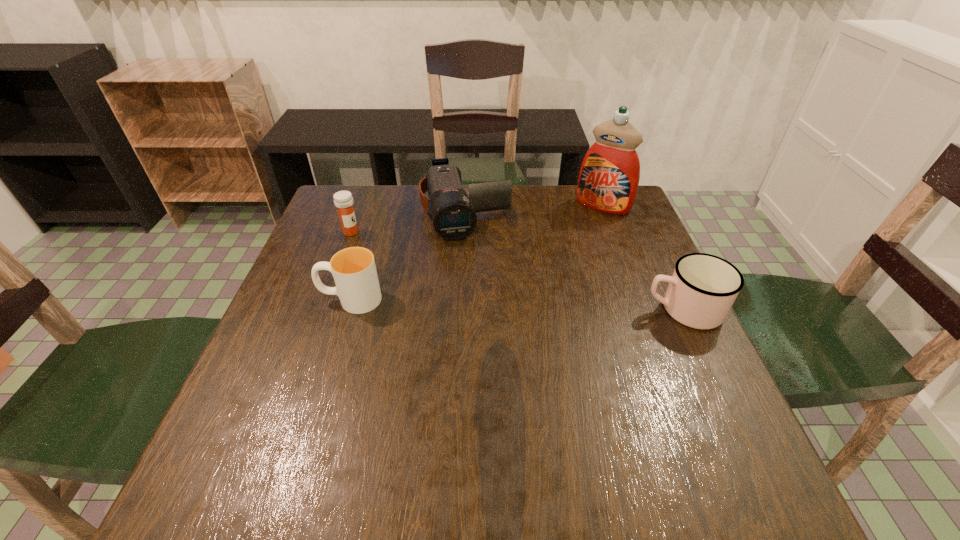
Identify the location of vacant space on the desktop that is between the cup and the mug and is positioned on the lens of the camcorder. Image resolution: width=960 pixels, height=540 pixels. (490, 303).

Identify the location of free space on the desktop that is between the cup and the mug and is positioned on the front surface of the tallest object. (541, 305).

The image size is (960, 540). Identify the location of vacant space on the desktop that is between the cup and the mug and is positioned on the label side of the medicine. (495, 303).